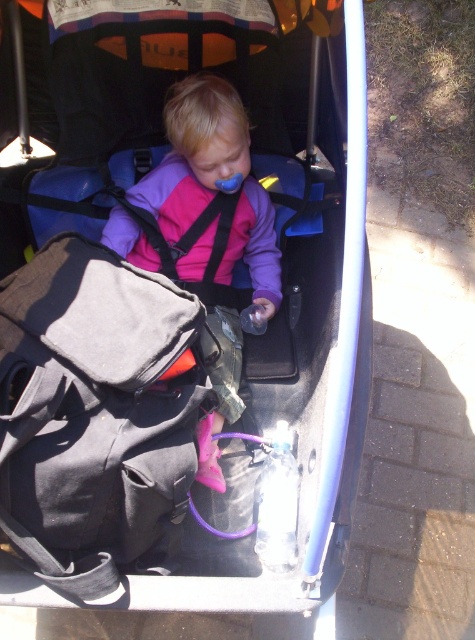
Does black fabric bag at lower left appear under black fabric strap at center?

Yes.

Does black fabric bag at lower left have a greater height compared to black fabric strap at center?

Indeed, black fabric bag at lower left has a greater height compared to black fabric strap at center.

This screenshot has width=475, height=640. What do you see at coordinates (95, 416) in the screenshot? I see `black fabric bag at lower left` at bounding box center [95, 416].

Find the location of a particular element. The image size is (475, 640). black fabric bag at lower left is located at coordinates (95, 416).

Who is shorter, black fabric bag at lower left or pink matte jacket at center?

black fabric bag at lower left is shorter.

Is point (107, 387) positioned behind point (237, 403)?

No, it is not.

The width and height of the screenshot is (475, 640). What do you see at coordinates (95, 416) in the screenshot? I see `black fabric bag at lower left` at bounding box center [95, 416].

This screenshot has width=475, height=640. What are the coordinates of `black fabric bag at lower left` in the screenshot? It's located at (95, 416).

Find the location of a particular element. The height and width of the screenshot is (640, 475). pink matte jacket at center is located at coordinates (215, 218).

Is pink matte jacket at center in front of black fabric strap at center?

Yes, pink matte jacket at center is closer to the viewer.

Find the location of a particular element. The image size is (475, 640). pink matte jacket at center is located at coordinates pyautogui.click(x=215, y=218).